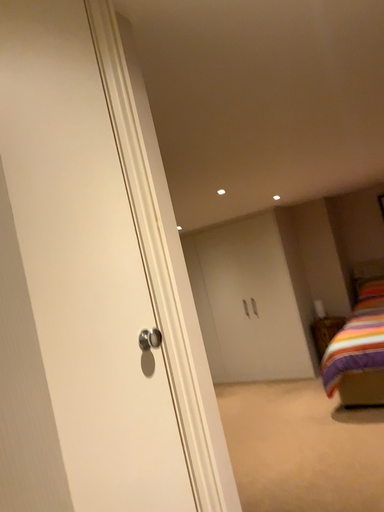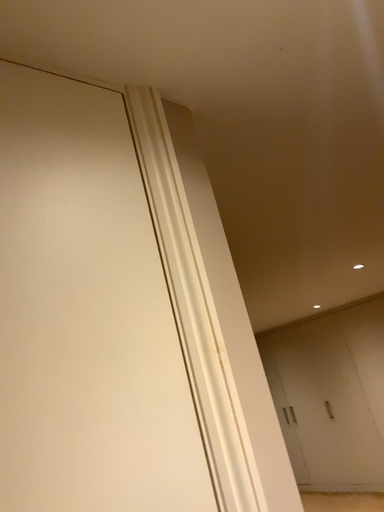
Question: Which way did the camera rotate in the video?

Choices:
 (A) rotated right
 (B) rotated left

Answer: (B)